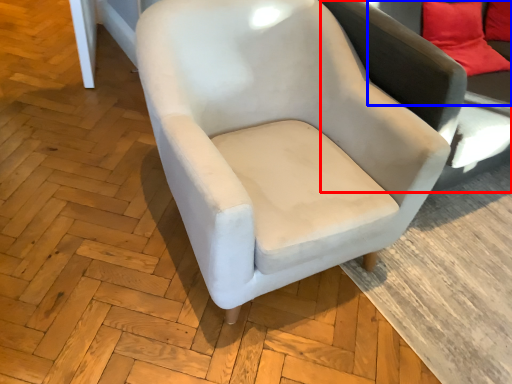
Question: Which object appears closest to the camera in this image, swivel chair (highlighted by a red box) or couch (highlighted by a blue box)?

Choices:
 (A) swivel chair
 (B) couch

Answer: (A)